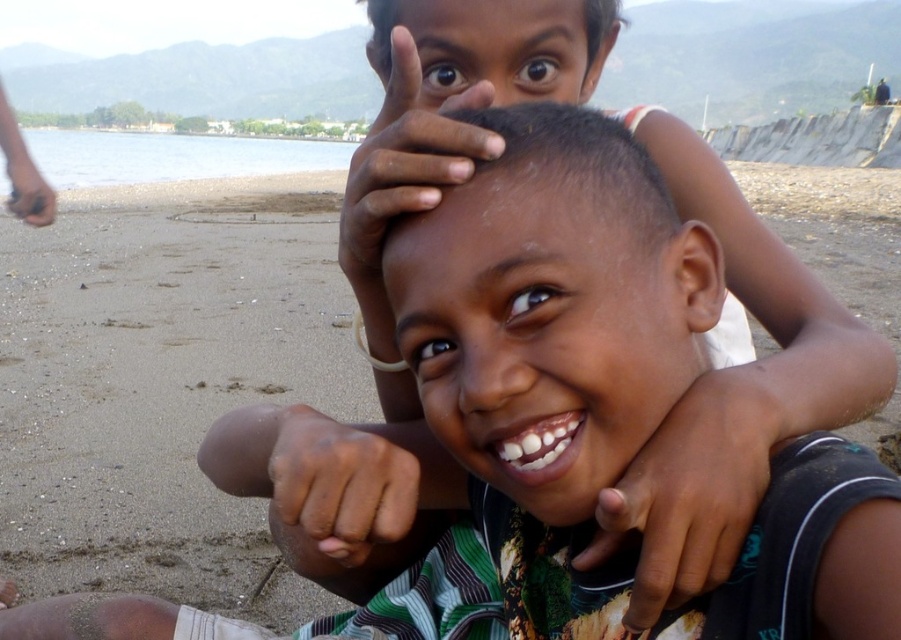
Between dark skin/flesh colored hand at lower center and brown skin hand at lower left, which one is positioned lower?

dark skin/flesh colored hand at lower center is below.

Is point (399, 451) closer to viewer compared to point (35, 168)?

Yes, point (399, 451) is in front of point (35, 168).

Who is more distant from viewer, [283,484] or [17,172]?

The point [17,172] is more distant.

Where is `dark skin/flesh colored hand at lower center`? Image resolution: width=901 pixels, height=640 pixels. dark skin/flesh colored hand at lower center is located at coordinates (344, 481).

Between dark skin hand at center and dry skin at upper center, which one is positioned higher?

Positioned higher is dry skin at upper center.

Which is behind, point (654, 454) or point (353, 161)?

The point (353, 161) is more distant.

This screenshot has width=901, height=640. What are the coordinates of `dark skin hand at center` in the screenshot? It's located at (690, 490).

Does dark skin hand at center have a smaller size compared to dark skin/flesh colored hand at lower center?

Yes, dark skin hand at center is smaller than dark skin/flesh colored hand at lower center.

Between point (766, 403) and point (361, 525), which one is positioned behind?

The point (766, 403) is behind.

At what (x,y) coordinates should I click in order to perform the action: click on dark skin hand at center. Please return your answer as a coordinate pair (x, y). Looking at the image, I should click on (690, 490).